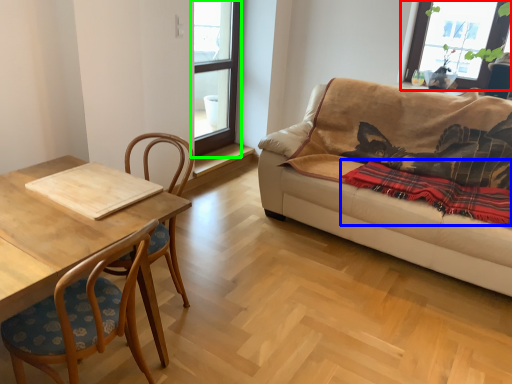
Question: Which is nearer to the window (highlighted by a red box)? blanket (highlighted by a blue box) or window (highlighted by a green box).

Choices:
 (A) blanket
 (B) window

Answer: (A)